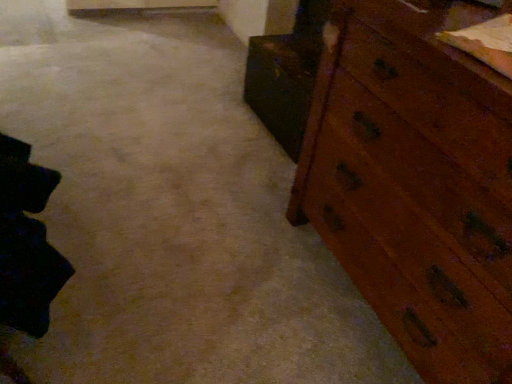
Question: In terms of height, does wooden chest of drawers at right look taller or shorter compared to wooden cabinet at right?

Choices:
 (A) tall
 (B) short

Answer: (A)

Question: From a real-world perspective, is wooden chest of drawers at right physically located above or below wooden cabinet at right?

Choices:
 (A) above
 (B) below

Answer: (A)

Question: Is wooden chest of drawers at right wider or thinner than wooden cabinet at right?

Choices:
 (A) thin
 (B) wide

Answer: (B)

Question: Considering the positions of wooden cabinet at right and wooden chest of drawers at right in the image, is wooden cabinet at right wider or thinner than wooden chest of drawers at right?

Choices:
 (A) wide
 (B) thin

Answer: (B)

Question: Is wooden cabinet at right bigger or smaller than wooden chest of drawers at right?

Choices:
 (A) small
 (B) big

Answer: (A)

Question: Does point (267, 112) appear closer or farther from the camera than point (450, 223)?

Choices:
 (A) closer
 (B) farther

Answer: (B)

Question: Considering the relative positions of wooden cabinet at right and wooden chest of drawers at right in the image provided, is wooden cabinet at right to the left or to the right of wooden chest of drawers at right?

Choices:
 (A) left
 (B) right

Answer: (A)